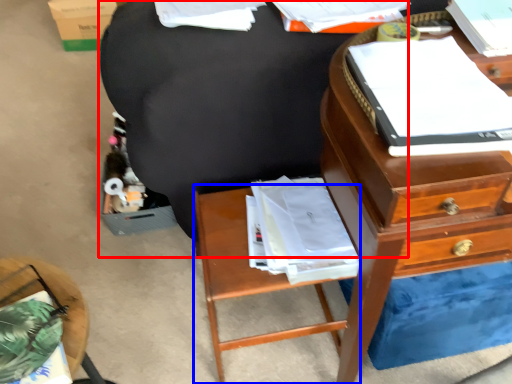
Question: Which object is further to the camera taking this photo, bean bag chair (highlighted by a red box) or nightstand (highlighted by a blue box)?

Choices:
 (A) bean bag chair
 (B) nightstand

Answer: (B)